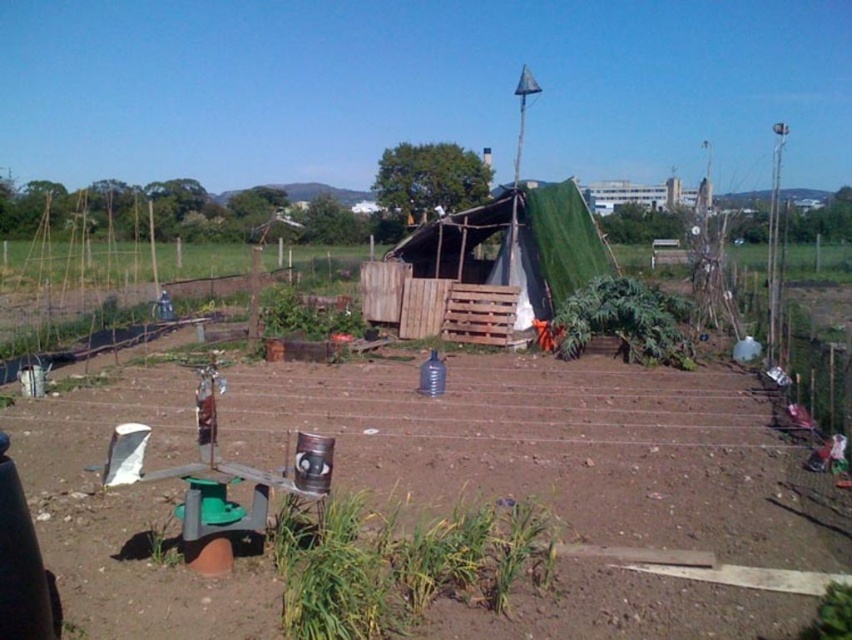
Question: Does brown soil at center appear on the left side of green tarpaulin tent at center?

Choices:
 (A) no
 (B) yes

Answer: (B)

Question: Is brown soil at center closer to the viewer compared to green tarpaulin tent at center?

Choices:
 (A) no
 (B) yes

Answer: (B)

Question: Among these objects, which one is farthest from the camera?

Choices:
 (A) green tarpaulin tent at center
 (B) brown soil at center

Answer: (A)

Question: From the image, what is the correct spatial relationship of brown soil at center in relation to green tarpaulin tent at center?

Choices:
 (A) below
 (B) above

Answer: (A)

Question: Among these objects, which one is nearest to the camera?

Choices:
 (A) green tarpaulin tent at center
 (B) brown soil at center

Answer: (B)